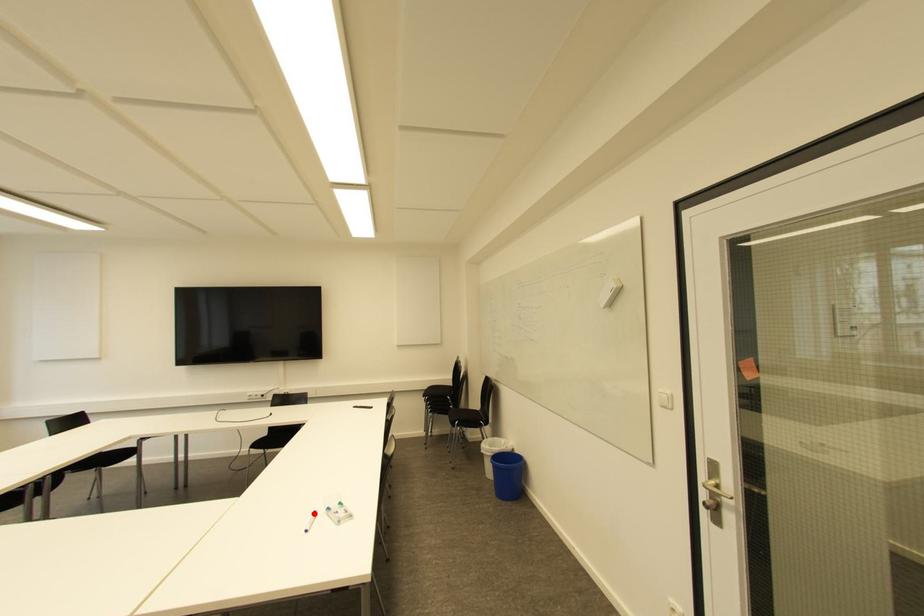
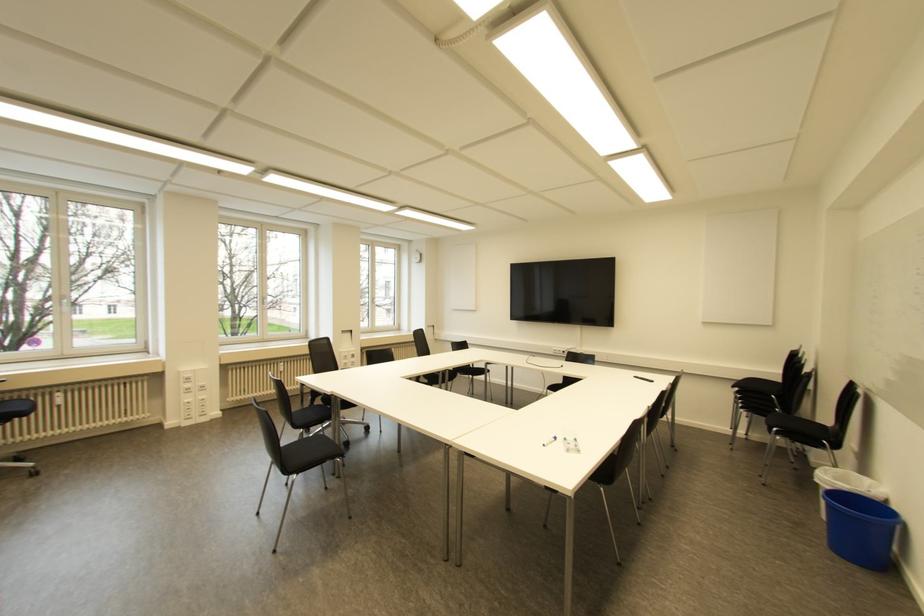
Where in the second image is the point corresponding to the highlighted location from the first image?

(554, 438)